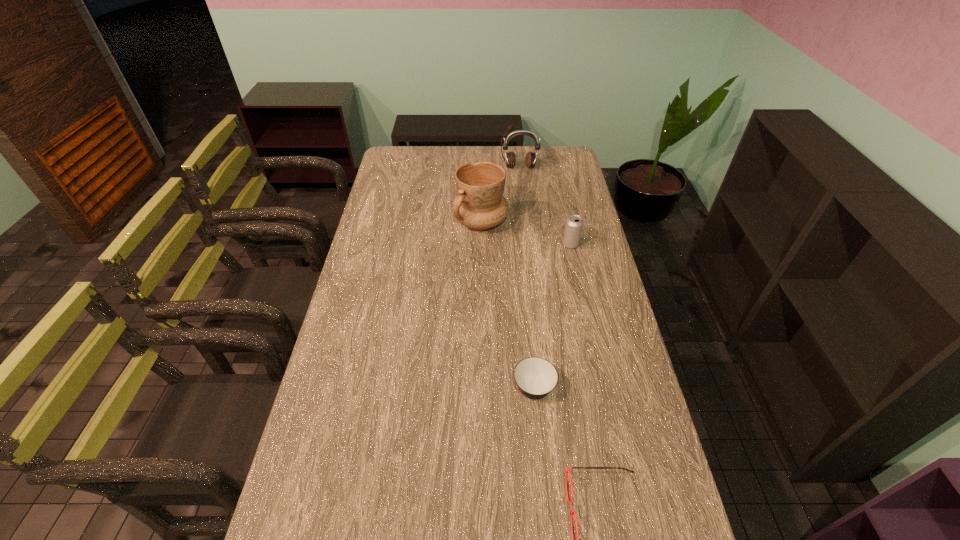
Locate an element on the screen. The height and width of the screenshot is (540, 960). free space at the far edge of the desktop is located at coordinates (482, 148).

Image resolution: width=960 pixels, height=540 pixels. In the image, there is a desktop. In order to click on free space at the left edge in this screenshot , I will do `click(305, 463)`.

I want to click on vacant space at the right edge of the desktop, so click(620, 375).

Locate an element on the screen. The width and height of the screenshot is (960, 540). vacant region at the far left corner of the desktop is located at coordinates (389, 170).

You are a GUI agent. You are given a task and a screenshot of the screen. Output one action in this format:
    pyautogui.click(x=<x>, y=<y>)
    Task: Click on the vacant area that lies between the beer can and the farthest object
    The width and height of the screenshot is (960, 540).
    Given the screenshot: What is the action you would take?
    pyautogui.click(x=545, y=206)

The height and width of the screenshot is (540, 960). What are the coordinates of `empty space between the third shortest object and the pottery` in the screenshot? It's located at (525, 233).

You are a GUI agent. You are given a task and a screenshot of the screen. Output one action in this format:
    pyautogui.click(x=<x>, y=<y>)
    Task: Click on the unoccupied position between the second nearest object and the pottery
    The width and height of the screenshot is (960, 540).
    Given the screenshot: What is the action you would take?
    pyautogui.click(x=507, y=306)

Where is `free space between the third shortest object and the pottery`? The height and width of the screenshot is (540, 960). free space between the third shortest object and the pottery is located at coordinates (525, 233).

The image size is (960, 540). In order to click on blank region between the third tallest object and the pottery in this screenshot , I will do `click(525, 233)`.

Identify which object is the second closest to the third tallest object. Please provide its 2D coordinates. Your answer should be formatted as a tuple, i.e. [(x, y)], where the tuple contains the x and y coordinates of a point satisfying the conditions above.

[(510, 159)]